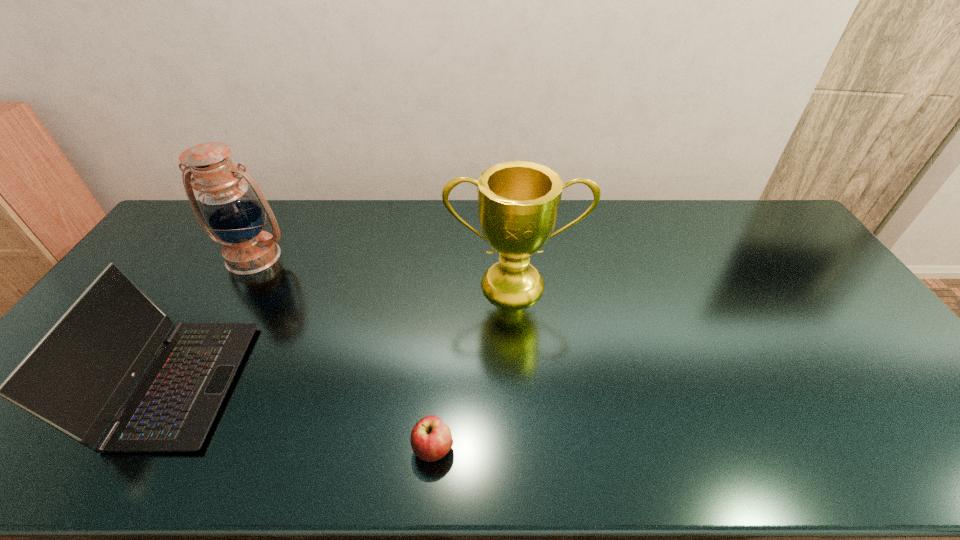
Image resolution: width=960 pixels, height=540 pixels. In order to click on vacant space at the far edge of the desktop in this screenshot , I will do `click(732, 233)`.

The height and width of the screenshot is (540, 960). I want to click on vacant space at the near edge, so click(x=372, y=448).

At what (x,y) coordinates should I click in order to perform the action: click on free region at the right edge of the desktop. Please return your answer as a coordinate pair (x, y). This screenshot has width=960, height=540. Looking at the image, I should click on (820, 264).

Image resolution: width=960 pixels, height=540 pixels. In the image, there is a desktop. Identify the location of vacant region at the far right corner. (775, 218).

Locate an element on the screen. This screenshot has width=960, height=540. free point between the apple and the award is located at coordinates (474, 366).

This screenshot has width=960, height=540. Find the location of `blank region between the shortest object and the laptop computer`. blank region between the shortest object and the laptop computer is located at coordinates (306, 416).

Where is `free point between the oil lamp and the apple`? free point between the oil lamp and the apple is located at coordinates (344, 353).

Identify the location of empty space that is in between the oil lamp and the award. Image resolution: width=960 pixels, height=540 pixels. (384, 271).

You are a GUI agent. You are given a task and a screenshot of the screen. Output one action in this format:
    pyautogui.click(x=<x>, y=<y>)
    Task: Click on the free space between the oil lamp and the award
    
    Given the screenshot: What is the action you would take?
    pyautogui.click(x=384, y=271)

This screenshot has width=960, height=540. In order to click on unoccupied area between the award and the laptop computer in this screenshot , I will do `click(347, 334)`.